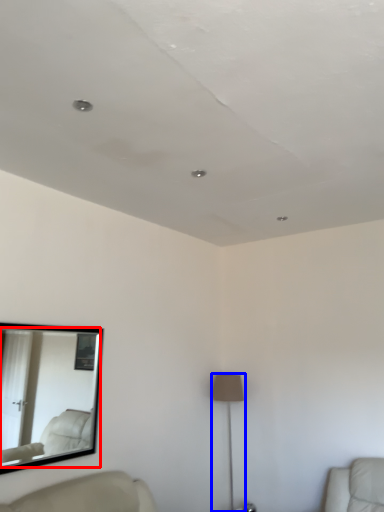
Question: Which object appears closest to the camera in this image, mirror (highlighted by a red box) or lamp (highlighted by a blue box)?

Choices:
 (A) mirror
 (B) lamp

Answer: (A)